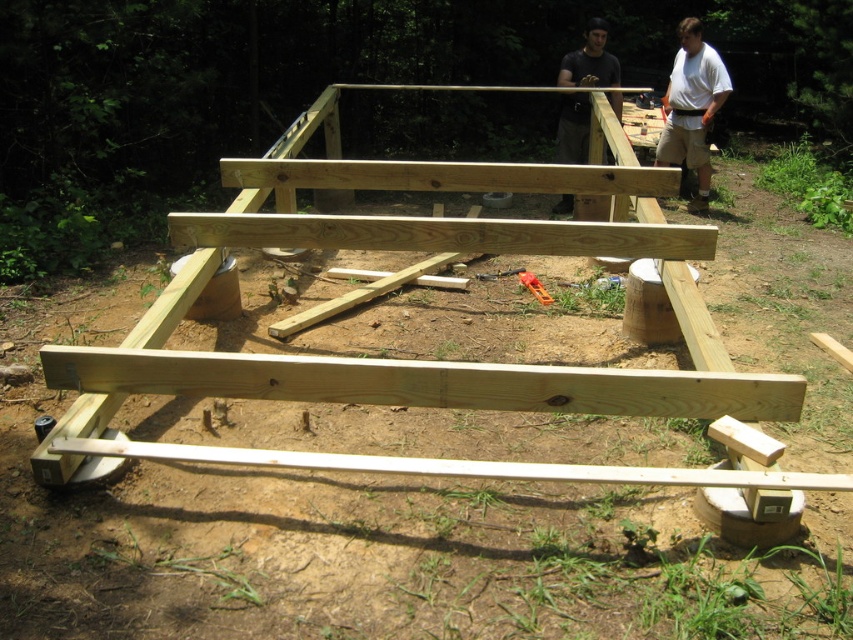
You are standing at the construction site and need to place a new beam between the two points labeled point [672,92] and point [570,61]. Based on their positions, which point should the beam start from to ensure it is placed correctly according to the structure?

The beam should start from point [570,61] because point [672,92] is behind it, so starting from the front point ensures proper placement.

From the picture: You are a contractor assessing the construction site. You need to determine if the natural wood frame at center can fit through a doorway that is the same width as the dark gray shirt at upper center. Can it fit?

The natural wood frame at center is wider than the dark gray shirt at upper center, so it cannot fit through the doorway that is the same width as the dark gray shirt at upper center.

You are standing at the center of the construction site and see the point marked at coordinates point (430, 360). Based on the scene description, can you determine which object this point is located on?

The point (430, 360) is located on the natural wood frame at center.